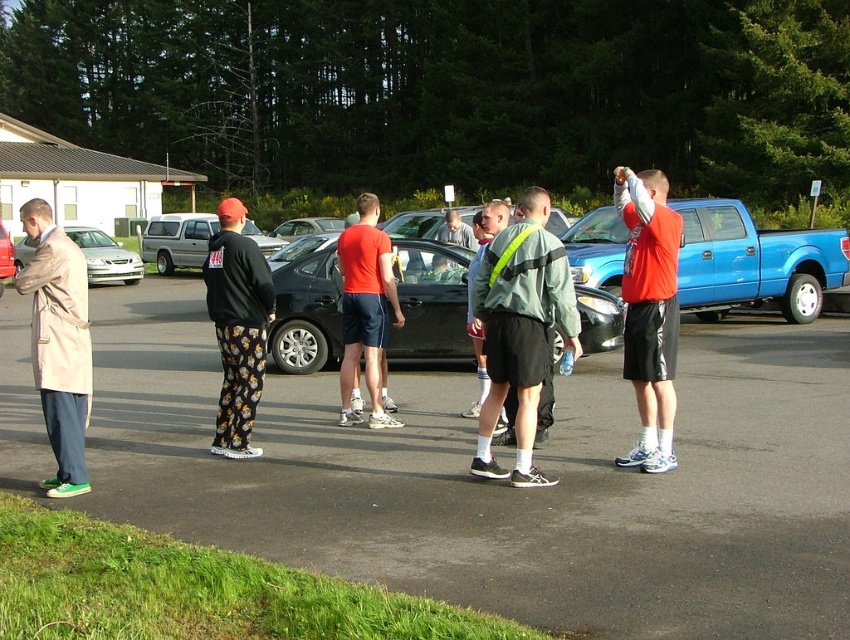
Question: Can you confirm if floral-patterned pants at center is positioned below matte red t-shirt at center?

Choices:
 (A) yes
 (B) no

Answer: (A)

Question: Is green reflective vest at center wider than red matte shorts at right?

Choices:
 (A) no
 (B) yes

Answer: (A)

Question: Which is farther from the shiny black car at center?

Choices:
 (A) shiny black sedan at center
 (B) matte red shirt at center
 (C) red matte shorts at right
 (D) matte red t-shirt at center

Answer: (A)

Question: Which of the following is the farthest from the observer?

Choices:
 (A) (264, 259)
 (B) (695, 428)
 (C) (301, 227)
 (D) (443, 227)

Answer: (C)

Question: Can you confirm if blue matte truck at right is positioned to the right of silver metallic sedan at center?

Choices:
 (A) yes
 (B) no

Answer: (A)

Question: Which object is the closest to the silver metallic sedan at center?

Choices:
 (A) floral-patterned pants at center
 (B) red matte shorts at right
 (C) matte silver suv at center

Answer: (C)